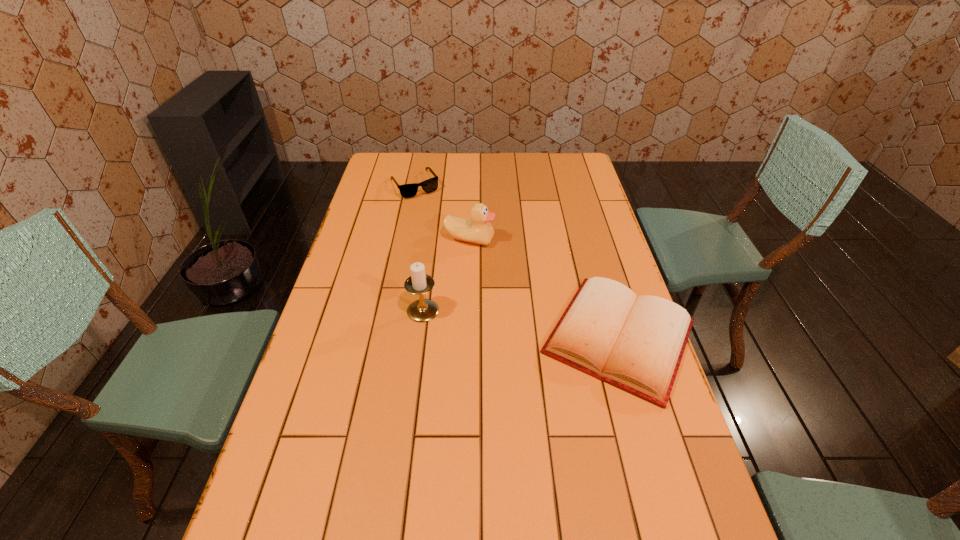
This screenshot has height=540, width=960. I want to click on free region at the near edge of the desktop, so click(427, 497).

This screenshot has height=540, width=960. I want to click on free space at the left edge, so click(x=350, y=341).

The image size is (960, 540). Identify the location of free location at the right edge of the desktop. (634, 452).

At what (x,y) coordinates should I click in order to perform the action: click on vacant space at the far left corner. Please return your answer as a coordinate pair (x, y). Looking at the image, I should click on (403, 154).

In the image, there is a desktop. Where is `vacant area at the near left corner`? Image resolution: width=960 pixels, height=540 pixels. vacant area at the near left corner is located at coordinates (323, 532).

Where is `free space at the far right corner of the desktop`? The height and width of the screenshot is (540, 960). free space at the far right corner of the desktop is located at coordinates (579, 168).

You are a GUI agent. You are given a task and a screenshot of the screen. Output one action in this format:
    pyautogui.click(x=<x>, y=<y>)
    Task: Click on the free spot between the second shortest object and the candle holder
    The width and height of the screenshot is (960, 540).
    Given the screenshot: What is the action you would take?
    pyautogui.click(x=419, y=248)

Where is `vacant area that lies between the third nearest object and the shortest object`? Image resolution: width=960 pixels, height=540 pixels. vacant area that lies between the third nearest object and the shortest object is located at coordinates (544, 288).

This screenshot has width=960, height=540. Find the location of `empty location between the Bible and the duck`. empty location between the Bible and the duck is located at coordinates (544, 288).

This screenshot has height=540, width=960. I want to click on free space between the third tallest object and the candle holder, so click(419, 248).